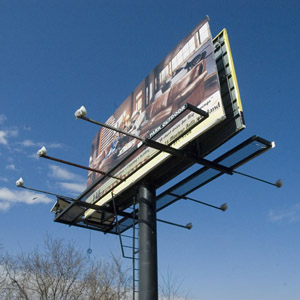
Where is `couch`? Image resolution: width=300 pixels, height=300 pixels. couch is located at coordinates (155, 108).